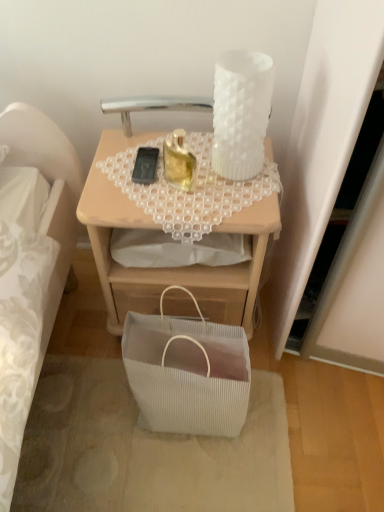
Identify the location of free space in front of black matte mobile phone at center. (145, 199).